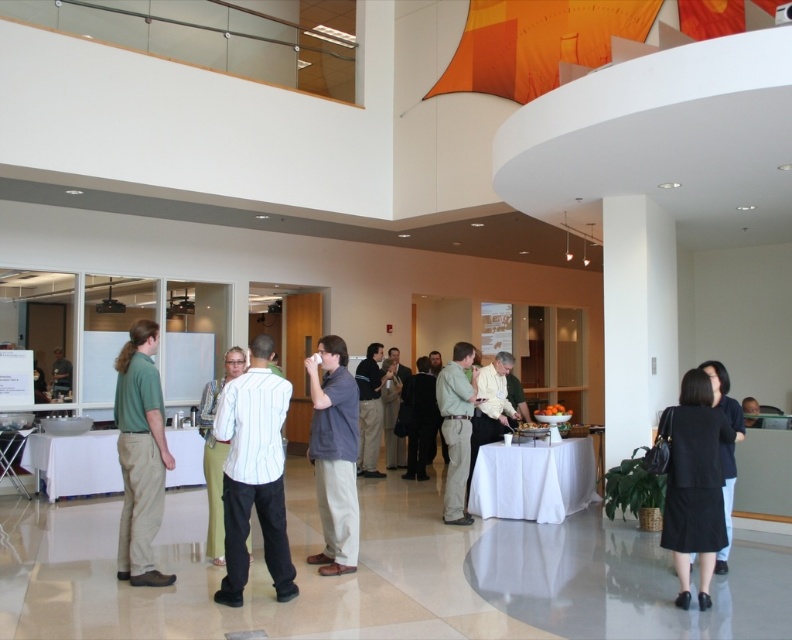
How much distance is there between dark brown leather jacket at center and black matte dress at lower right?

dark brown leather jacket at center is 5.12 meters from black matte dress at lower right.

Can you confirm if dark brown leather jacket at center is shorter than black matte dress at lower right?

In fact, dark brown leather jacket at center may be taller than black matte dress at lower right.

Between point (414, 451) and point (718, 570), which one is positioned in front?

Point (718, 570) is in front.

Where is `dark brown leather jacket at center`? This screenshot has width=792, height=640. dark brown leather jacket at center is located at coordinates (419, 419).

Between black matte dress at lower right and matte green shirt at left, which one is positioned lower?

black matte dress at lower right is below.

In the scene shown: Which of these two, black matte dress at lower right or matte green shirt at left, stands taller?

With more height is black matte dress at lower right.

Identify the location of black matte dress at lower right. The height and width of the screenshot is (640, 792). (724, 396).

Who is taller, white cloth table at center or white glossy table at lower left?

white cloth table at center

Does white cloth table at center have a greater width compared to white glossy table at lower left?

Yes, white cloth table at center is wider than white glossy table at lower left.

Does point (545, 490) lie behind point (59, 484)?

No.

You are a GUI agent. You are given a task and a screenshot of the screen. Output one action in this format:
    pyautogui.click(x=<x>, y=<y>)
    Task: Click on the white cloth table at center
    This screenshot has width=792, height=640.
    Given the screenshot: What is the action you would take?
    click(x=532, y=480)